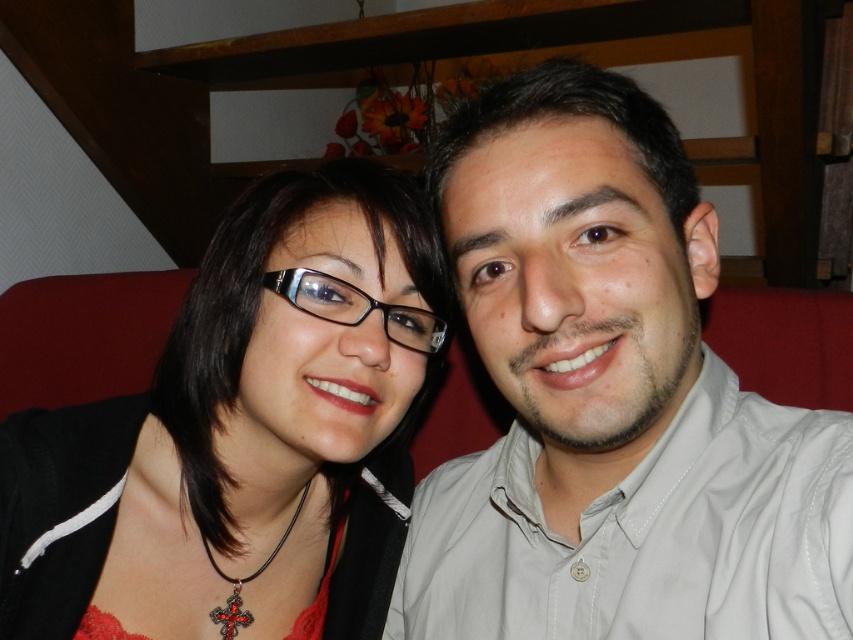
You are taking a photo of the two people in the scene. The matte black glasses at center are blocking your view. Can you move the glasses to a different location so they are no longer in the center? Explain how you would do this.

The matte black glasses at center are located at point (x=242, y=435). To move them out of the center, you would need to adjust their position to coordinates outside this point, such as moving them left or right along the x or y axis to a new location that doesn,t obstruct the view.

You are a photographer who wants to take a picture of the light beige shirt at center and the transparent plastic glasses at center. To ensure both are in focus, you need to know their relative positions. Which object is located to the right of the other?

The light beige shirt at center is positioned on the right side of transparent plastic glasses at center, so the light beige shirt at center is to the right of the transparent plastic glasses at center.

You are a photographer trying to capture a closeup of the light beige shirt at center. The camera you are using has a minimum focusing distance of 14 inches. Can you take the photo without moving the shirt?

The light beige shirt at center is 15.02 inches from the camera, which is beyond the minimum focusing distance of 14 inches. Therefore, you can take the photo without moving the shirt.